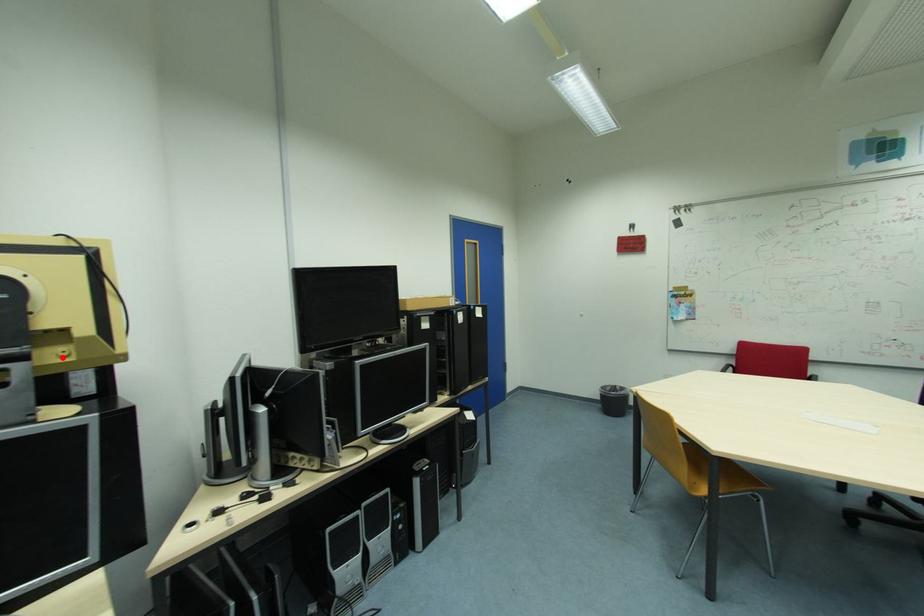
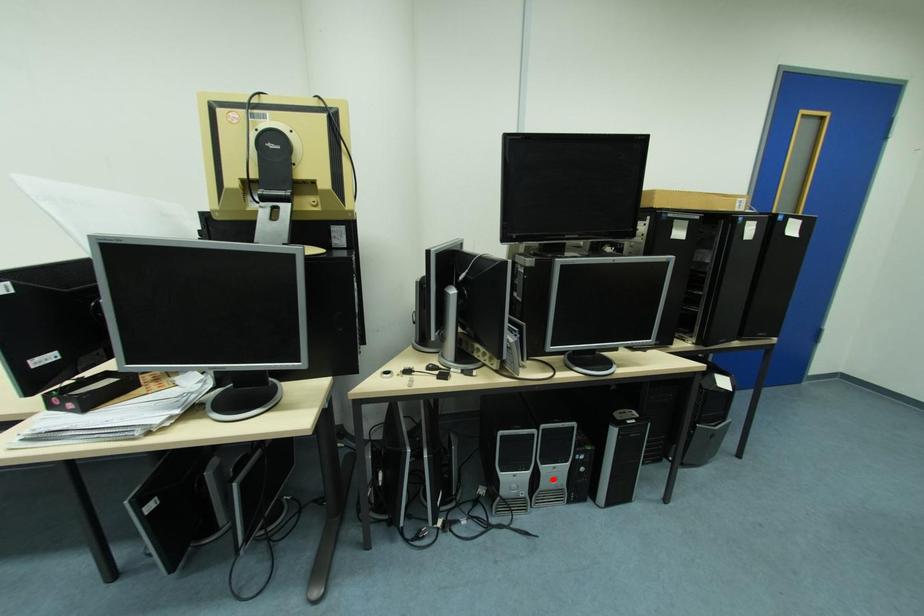
I am providing you with two images of the same scene from different viewpoints. A red point is marked on the first image and another point is marked on the second image. Does the point marked in image1 correspond to the same location as the one in image2?

No